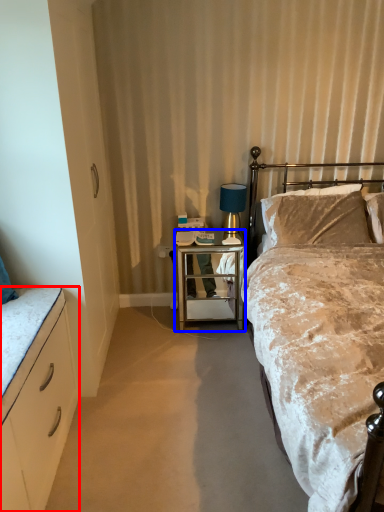
Question: Which object appears farthest to the camera in this image, cabinetry (highlighted by a red box) or desk (highlighted by a blue box)?

Choices:
 (A) cabinetry
 (B) desk

Answer: (B)